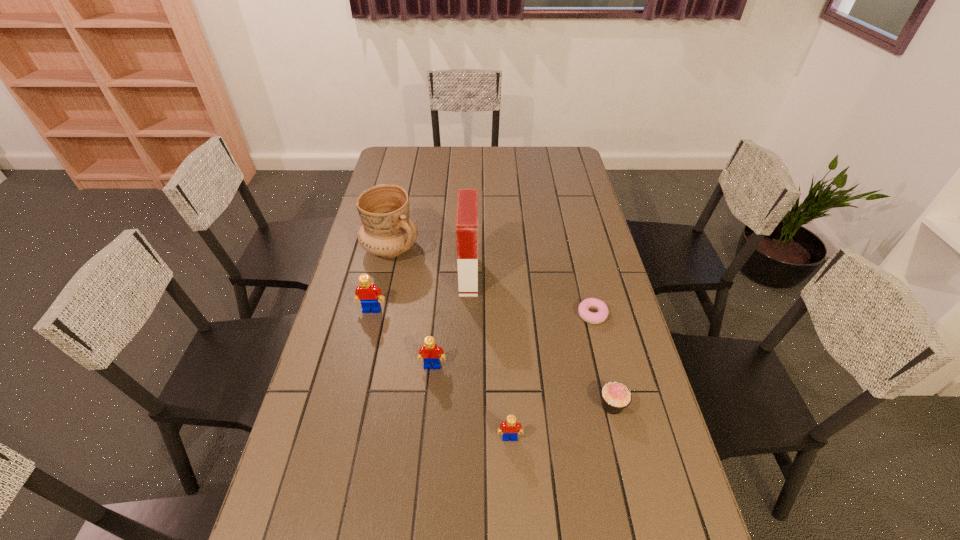
Identify the location of free space that satisfies the following two spatial constraints: 1. on the front-facing side of the tallest object; 2. on the front-facing side of the leftmost Lego. (468, 310).